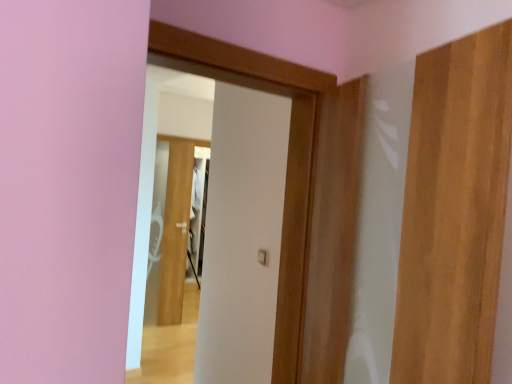
The image size is (512, 384). I want to click on white glossy door at center, the first door positioned from the back, so click(x=175, y=229).

The width and height of the screenshot is (512, 384). Describe the element at coordinates (454, 211) in the screenshot. I see `wooden door at right, positioned as the 3th door in left-to-right order` at that location.

Locate an element on the screen. Image resolution: width=512 pixels, height=384 pixels. white glossy door at center, the first door positioned from the back is located at coordinates (175, 229).

Which object is wider, white matte door at center, the 2th door when ordered from back to front, or white glossy door at center, the first door positioned from the left?

white matte door at center, the 2th door when ordered from back to front.

From a real-world perspective, which object rests below the other?

white glossy door at center, the first door positioned from the back.

From the picture: Is white matte door at center, which ranks as the second door in left-to-right order, in contact with white glossy door at center, the first door positioned from the left?

white matte door at center, which ranks as the second door in left-to-right order, is not next to white glossy door at center, the first door positioned from the left, and they're not touching.

Is white matte door at center, arranged as the second door when viewed from the front, positioned with its back to white glossy door at center, the first door positioned from the back?

No, white matte door at center, arranged as the second door when viewed from the front, is not facing the opposite direction of white glossy door at center, the first door positioned from the back.

Is wooden door at right, acting as the 3th door starting from the back, positioned before white glossy door at center, the 3th door viewed from the right?

That is True.

From a real-world perspective, is wooden door at right, which is counted as the first door, starting from the front, above or below white glossy door at center, the 3th door viewed from the right?

In terms of real-world spatial position, wooden door at right, which is counted as the first door, starting from the front, is above white glossy door at center, the 3th door viewed from the right.

Between point (430, 264) and point (166, 234), which one is positioned in front?

The point (430, 264) is more forward.

Can you confirm if wooden door at right, acting as the 3th door starting from the back, is wider than white glossy door at center, the third door viewed from the front?

Yes, wooden door at right, acting as the 3th door starting from the back, is wider than white glossy door at center, the third door viewed from the front.

Is point (310, 194) positioned after point (499, 82)?

Yes.

Would you consider white matte door at center, the 2th door when ordered from back to front, to be distant from wooden door at right, which is counted as the first door, starting from the front?

No, white matte door at center, the 2th door when ordered from back to front, is in close proximity to wooden door at right, which is counted as the first door, starting from the front.

Where is `door on the right of the white matte door at center, the 2th door when ordered from back to front`? door on the right of the white matte door at center, the 2th door when ordered from back to front is located at coordinates (454, 211).

From the image's perspective, who appears lower, white matte door at center, the 2th door when ordered from back to front, or wooden door at right, positioned as the 3th door in left-to-right order?

From the image's view, wooden door at right, positioned as the 3th door in left-to-right order, is below.

Is white glossy door at center, the first door positioned from the left, next to wooden door at right, which is counted as the first door, starting from the front, and touching it?

There is a gap between white glossy door at center, the first door positioned from the left, and wooden door at right, which is counted as the first door, starting from the front.

Is white glossy door at center, the 3th door viewed from the right, oriented away from wooden door at right, which is counted as the first door, starting from the front?

white glossy door at center, the 3th door viewed from the right, does not have its back to wooden door at right, which is counted as the first door, starting from the front.

How different are the orientations of white glossy door at center, the first door positioned from the left, and wooden door at right, the first door viewed from the right, in degrees?

38.6 degrees.

Is wooden door at right, acting as the 3th door starting from the back, not close to white matte door at center, arranged as the second door when viewed from the front?

wooden door at right, acting as the 3th door starting from the back, is near white matte door at center, arranged as the second door when viewed from the front, not far away.

Considering the relative positions of wooden door at right, the first door viewed from the right, and white matte door at center, arranged as the second door when viewed from the front, in the image provided, is wooden door at right, the first door viewed from the right, to the left of white matte door at center, arranged as the second door when viewed from the front, from the viewer's perspective?

In fact, wooden door at right, the first door viewed from the right, is to the right of white matte door at center, arranged as the second door when viewed from the front.

Considering their positions, is wooden door at right, which is counted as the first door, starting from the front, located in front of or behind white matte door at center, the 2th door when ordered from back to front?

In the image, wooden door at right, which is counted as the first door, starting from the front, appears in front of white matte door at center, the 2th door when ordered from back to front.

Is white glossy door at center, the first door positioned from the back, bigger or smaller than white matte door at center, the second door in the right-to-left sequence?

Clearly, white glossy door at center, the first door positioned from the back, is smaller in size than white matte door at center, the second door in the right-to-left sequence.

Does point (181, 175) come farther from viewer compared to point (307, 113)?

Yes, it is.

Is the position of white glossy door at center, the 3th door viewed from the right, more distant than that of white matte door at center, the 2th door when ordered from back to front?

Result: Yes.

From a real-world perspective, count 1st doors upward from the white glossy door at center, the third door viewed from the front, and point to it. Please provide its 2D coordinates.

[(284, 205)]

From the wooden door at right, the first door viewed from the right, count the 2nd door to the left and point to it. Please provide its 2D coordinates.

[(175, 229)]

Looking at the image, which one is located closer to white glossy door at center, the 3th door viewed from the right, wooden door at right, the first door viewed from the right, or white matte door at center, arranged as the second door when viewed from the front?

white matte door at center, arranged as the second door when viewed from the front, is closer to white glossy door at center, the 3th door viewed from the right.

Which object lies nearer to the anchor point wooden door at right, which is counted as the first door, starting from the front, white matte door at center, which ranks as the second door in left-to-right order, or white glossy door at center, the 3th door viewed from the right?

white matte door at center, which ranks as the second door in left-to-right order, is closer to wooden door at right, which is counted as the first door, starting from the front.

Estimate the real-world distances between objects in this image. Which object is closer to white glossy door at center, the 3th door viewed from the right, white matte door at center, arranged as the second door when viewed from the front, or wooden door at right, the first door viewed from the right?

Based on the image, white matte door at center, arranged as the second door when viewed from the front, appears to be nearer to white glossy door at center, the 3th door viewed from the right.

When comparing their distances from white matte door at center, which ranks as the second door in left-to-right order, does wooden door at right, the first door viewed from the right, or white glossy door at center, the 3th door viewed from the right, seem closer?

The object closer to white matte door at center, which ranks as the second door in left-to-right order, is wooden door at right, the first door viewed from the right.

Looking at the image, which one is located further to wooden door at right, positioned as the 3th door in left-to-right order, white glossy door at center, the 3th door viewed from the right, or white matte door at center, arranged as the second door when viewed from the front?

white glossy door at center, the 3th door viewed from the right, is further to wooden door at right, positioned as the 3th door in left-to-right order.

Based on their spatial positions, is white glossy door at center, the 3th door viewed from the right, or wooden door at right, the first door viewed from the right, further from white matte door at center, which ranks as the second door in left-to-right order?

white glossy door at center, the 3th door viewed from the right, is further to white matte door at center, which ranks as the second door in left-to-right order.

Locate an element on the screen. The width and height of the screenshot is (512, 384). door between wooden door at right, acting as the 3th door starting from the back, and white glossy door at center, the first door positioned from the left, in the front-back direction is located at coordinates (284, 205).